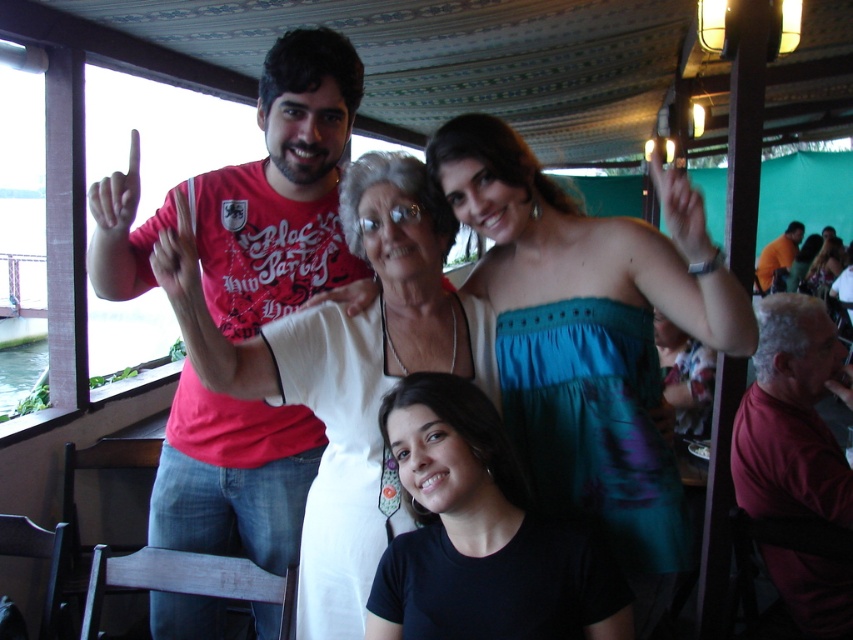
Question: Which point is farther to the camera?

Choices:
 (A) dark red shirt at right
 (B) black matte shirt at lower center
 (C) orange shirt at upper right
 (D) matte white dress at center

Answer: (C)

Question: Where is matte red t-shirt at upper left located in relation to black matte shirt at lower center in the image?

Choices:
 (A) above
 (B) below

Answer: (A)

Question: Can you confirm if white fabric at center is wider than orange shirt at upper right?

Choices:
 (A) no
 (B) yes

Answer: (A)

Question: Which of these objects is positioned farthest from the white fabric at center?

Choices:
 (A) matte red t-shirt at upper left
 (B) dark red shirt at right
 (C) black matte shirt at lower center

Answer: (B)

Question: In this image, where is matte red t-shirt at upper left located relative to black matte shirt at lower center?

Choices:
 (A) right
 (B) left

Answer: (B)

Question: Which point is closer to the camera taking this photo?

Choices:
 (A) (544, 636)
 (B) (252, 401)

Answer: (A)